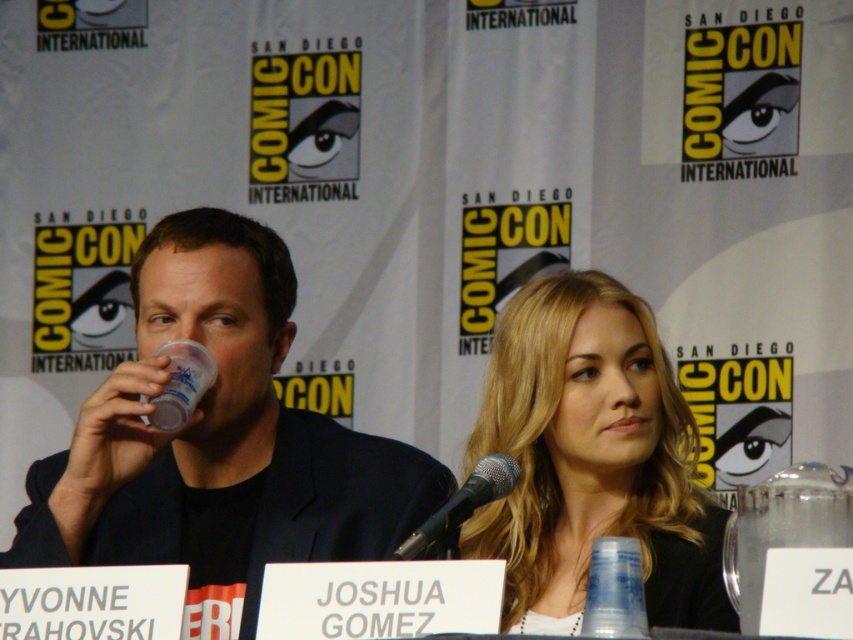
Question: Which object is positioned closest to the translucent plastic cup at upper left?

Choices:
 (A) transparent glass jar at right
 (B) transparent plastic cup at center

Answer: (A)

Question: Which is farther from the transparent glass jar at right?

Choices:
 (A) translucent plastic cup at upper left
 (B) blonde hair at center
 (C) black metallic microphone at center

Answer: (A)

Question: Does transparent plastic cup at center appear over black metallic microphone at center?

Choices:
 (A) no
 (B) yes

Answer: (A)

Question: Which point is closer to the camera?

Choices:
 (A) translucent plastic cup at upper left
 (B) transparent plastic cup at center

Answer: (B)

Question: Can you confirm if black matte suit at center is positioned below transparent glass jar at right?

Choices:
 (A) no
 (B) yes

Answer: (A)

Question: Can you confirm if black matte suit at center is positioned above translucent plastic cup at upper left?

Choices:
 (A) yes
 (B) no

Answer: (B)